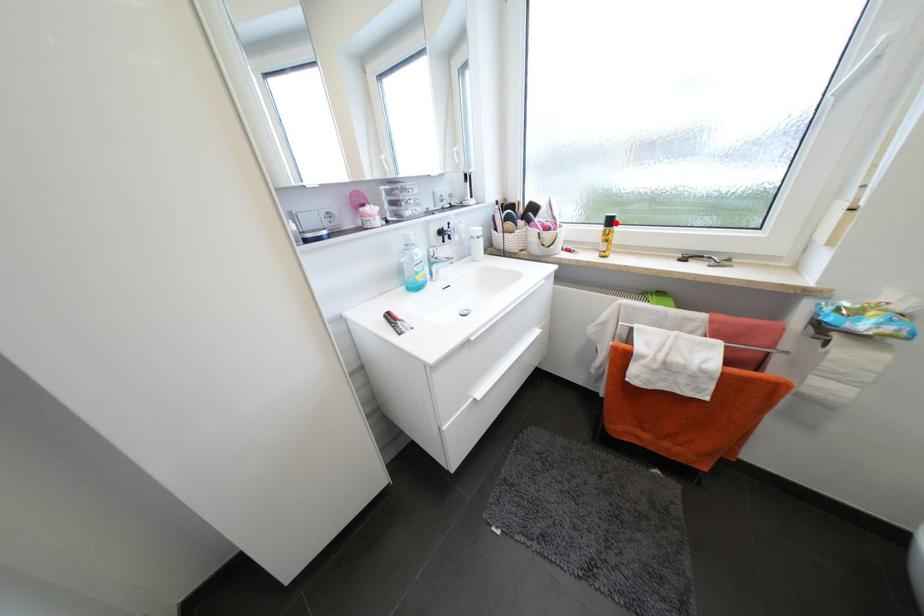
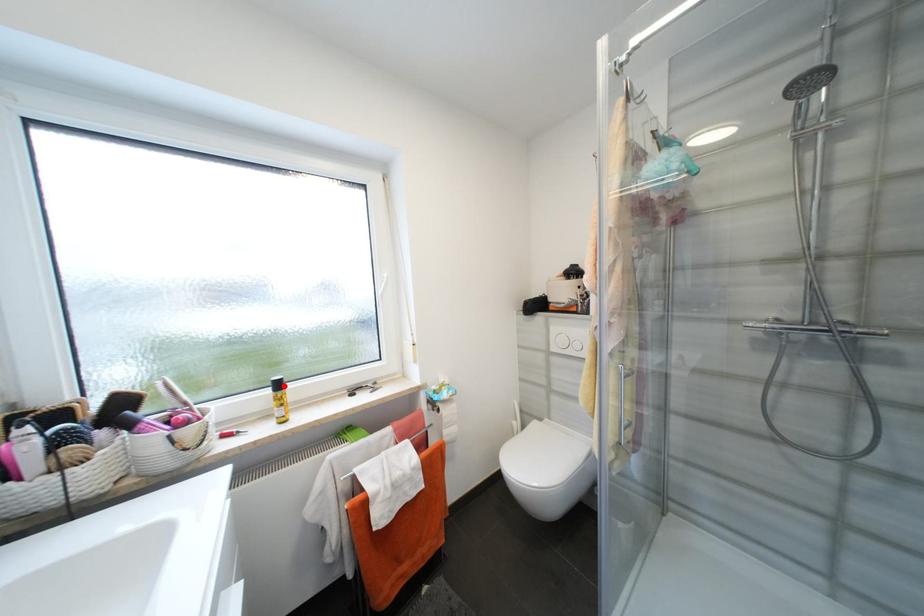
Consider the image. I am providing you with two images of the same scene from different viewpoints. A red point is marked on the first image and another point is marked on the second image. Are the points marked in image1 and image2 representing the same 3D position?

Yes